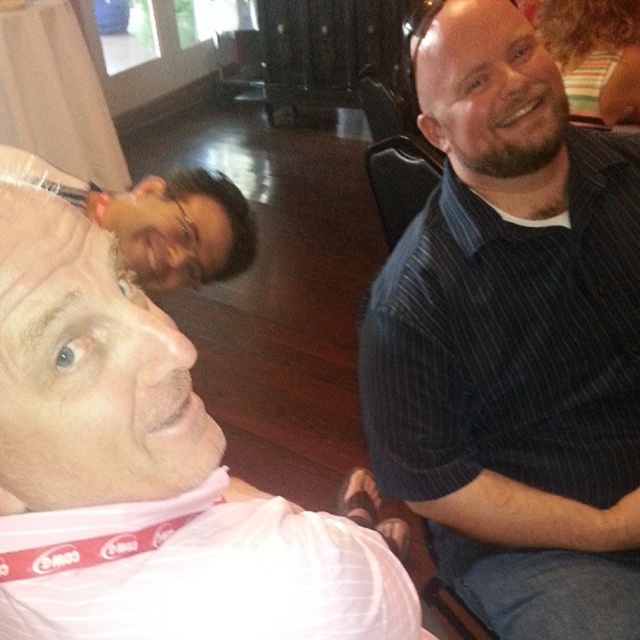
Is dark blue striped shirt at right taller than pink fabric shirt at lower left?

Correct, dark blue striped shirt at right is much taller as pink fabric shirt at lower left.

Is point (486, 236) in front of point (49, 461)?

No, it is behind (49, 461).

Which is in front, point (500, 513) or point (90, 600)?

Point (90, 600)

The image size is (640, 640). I want to click on dark blue striped shirt at right, so click(513, 339).

Which is more to the right, pink fabric shirt at lower left or dark blue striped shirt at upper right?

dark blue striped shirt at upper right is more to the right.

Is pink fabric shirt at lower left to the right of dark blue striped shirt at upper right from the viewer's perspective?

No, pink fabric shirt at lower left is not to the right of dark blue striped shirt at upper right.

Which is in front, point (275, 620) or point (528, 83)?

Point (275, 620) is more forward.

Locate an element on the screen. This screenshot has width=640, height=640. pink fabric shirt at lower left is located at coordinates (145, 467).

Which is more to the right, dark blue striped shirt at right or dark brown hair at upper left?

From the viewer's perspective, dark blue striped shirt at right appears more on the right side.

Is point (451, 353) positioned after point (236, 269)?

No, it is in front of (236, 269).

Does point (540, 529) come farther from viewer compared to point (230, 227)?

No, (540, 529) is in front of (230, 227).

Image resolution: width=640 pixels, height=640 pixels. Identify the location of dark blue striped shirt at right. (513, 339).